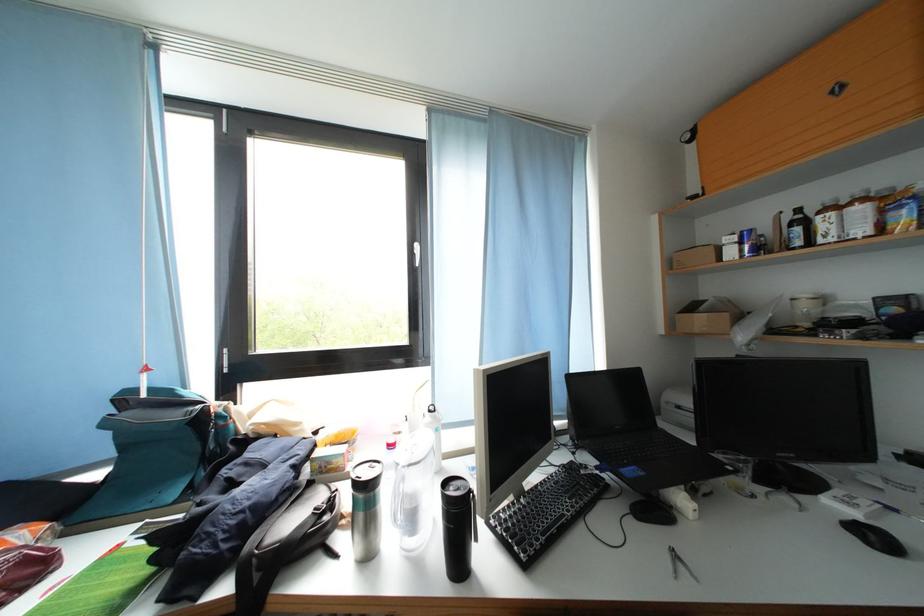
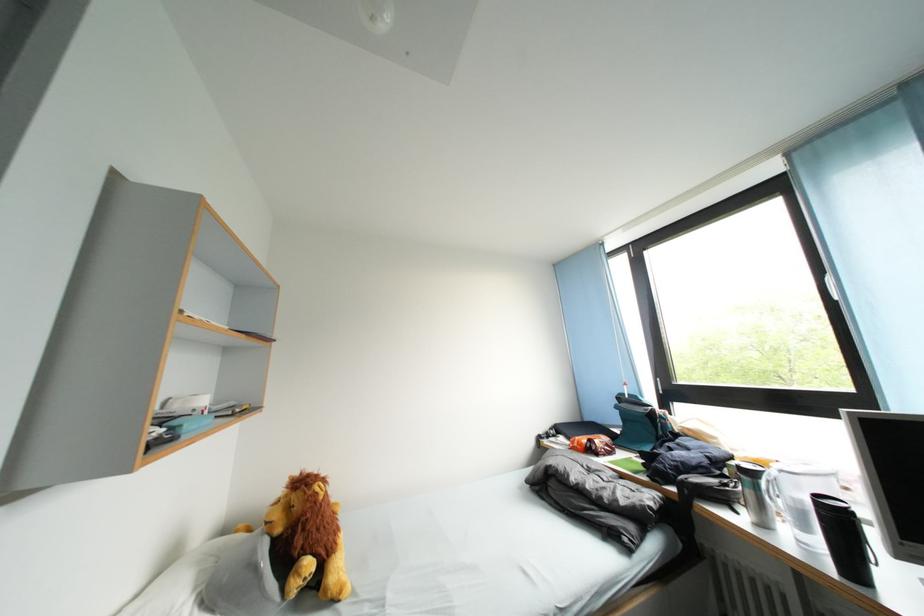
Locate, in the second image, the point that corresponds to pixel 154 375 in the first image.

(634, 389)